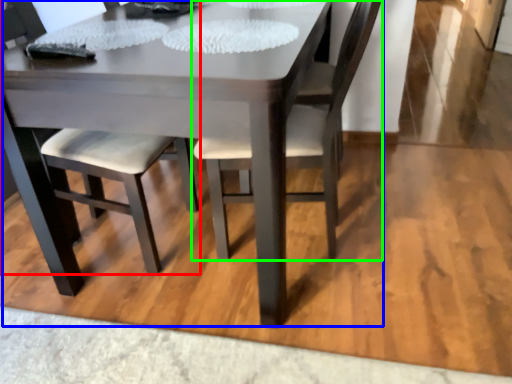
Question: Which is farther away from chair (highlighted by a red box)? kitchen & dining room table (highlighted by a blue box) or chair (highlighted by a green box)?

Choices:
 (A) kitchen & dining room table
 (B) chair

Answer: (B)